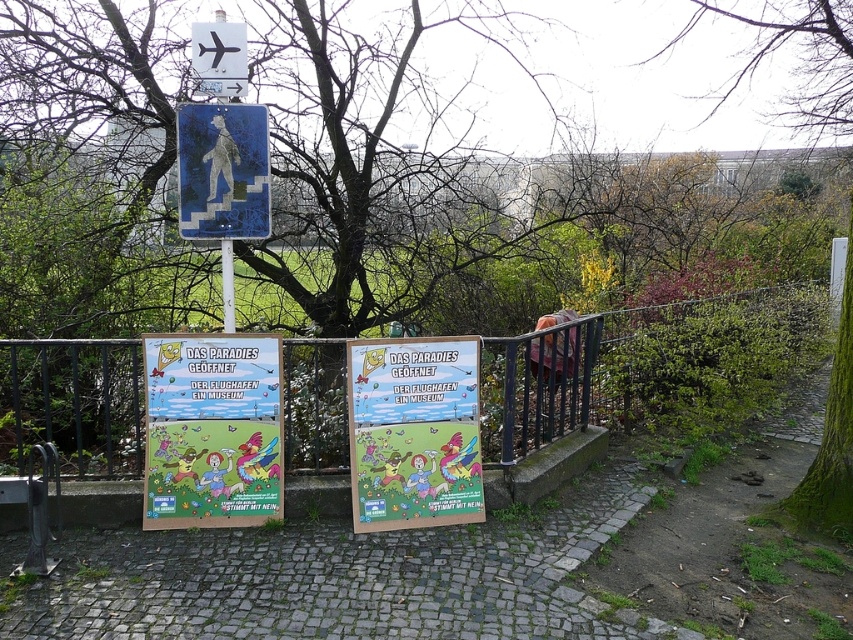
You are a tour guide leading a group of visitors through a historic town. You notice a cobblestone path at center and a blue painted pedestrian sign at center. Which one is wider?

The cobblestone path at center is wider than the blue painted pedestrian sign at center.

You are standing at the point marked as point [334,577] in the image. Looking around, you see the two colorful posters on the railing. Which direction should you walk to reach the cobblestone path at center?

The point [334,577] is already on the cobblestone path at center, so you are already there.

You are standing in front of the two colorful posters on the metal railing. You notice two points marked on the posters. The first point is at coordinates point (x=373, y=436) and the second is at point (x=834, y=20). Which point is closer to you?

Point (x=373, y=436) is closer to the viewer than point (x=834, y=20).